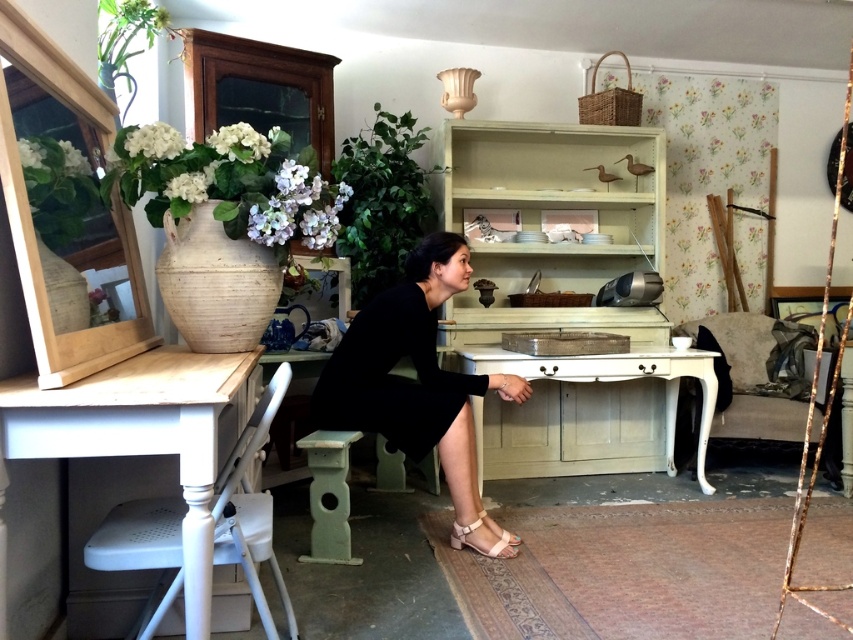
Question: Observing the image, what is the correct spatial positioning of white painted wood chair at lower left in reference to white painted wood table at center?

Choices:
 (A) below
 (B) above

Answer: (A)

Question: Estimate the real-world distances between objects in this image. Which object is closer to the white painted wood chair at lower left?

Choices:
 (A) matte beige sandal at lower center
 (B) velvet beige sofa at right

Answer: (A)

Question: Does velvet beige sofa at right appear under matte beige sandal at lower center?

Choices:
 (A) no
 (B) yes

Answer: (A)

Question: Which point appears farthest from the camera in this image?

Choices:
 (A) (393, 316)
 (B) (527, 424)

Answer: (B)

Question: Is white painted wood table at center behind matte beige sandal at lower center?

Choices:
 (A) yes
 (B) no

Answer: (A)

Question: Which point is closer to the camera?

Choices:
 (A) (485, 524)
 (B) (828, 360)
 (C) (424, 364)

Answer: (C)